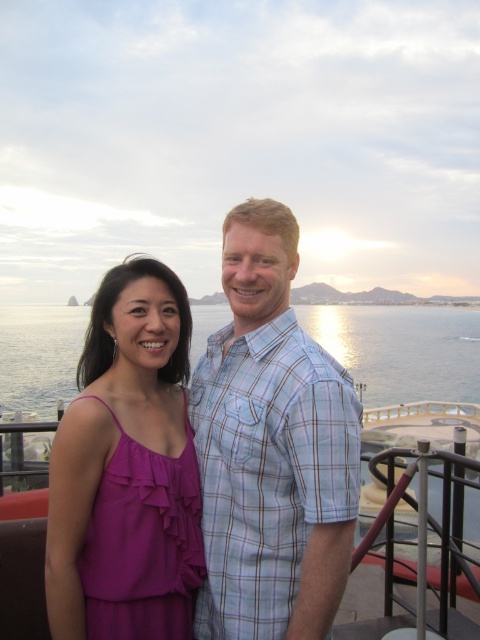
You are a photographer trying to capture the two people in the scene. Since the light blue plaid shirt at center and the blue water at center are both in the frame, which object should you focus on first if you want to ensure both are in focus? Explain your reasoning based on their sizes.

The light blue plaid shirt at center is smaller than the blue water at center, so focusing on the larger blue water at center first would help ensure both are in focus because larger objects often have a greater depth of field.

You are an AI analyzing the image. What is the 2D coordinate of the light blue plaid shirt at center?

The 2D coordinate of the light blue plaid shirt at center is at point (271, 449).